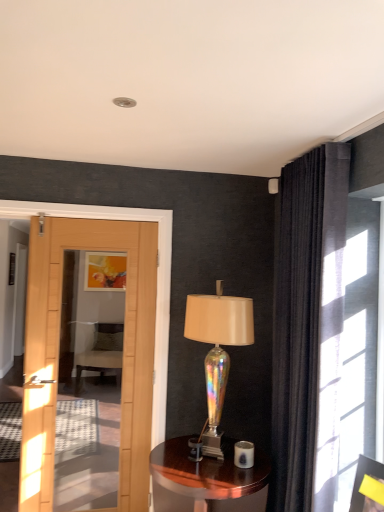
Question: In the image, is yellow paper at upper right, acting as the first picture frame starting from the right, positioned in front of or behind iridescent glass lamp at center?

Choices:
 (A) behind
 (B) front

Answer: (B)

Question: Considering the positions of yellow paper at upper right, the second picture frame from the back, and iridescent glass lamp at center in the image, is yellow paper at upper right, the second picture frame from the back, taller or shorter than iridescent glass lamp at center?

Choices:
 (A) short
 (B) tall

Answer: (A)

Question: Which object is the closest to the velvet green chair at center?

Choices:
 (A) dark velvet curtain at upper right
 (B) shiny brown wood side table at center
 (C) yellow paper at upper right, the second picture frame from the back
 (D) iridescent glass lamp at center
 (E) matte yellow picture frame at upper center, arranged as the first picture frame when viewed from the back

Answer: (E)

Question: Which object is the farthest from the shiny brown wood side table at center?

Choices:
 (A) dark velvet curtain at upper right
 (B) velvet green chair at center
 (C) iridescent glass lamp at center
 (D) matte yellow picture frame at upper center, positioned as the 1th picture frame in top-to-bottom order
 (E) yellow paper at upper right, acting as the first picture frame starting from the right

Answer: (D)